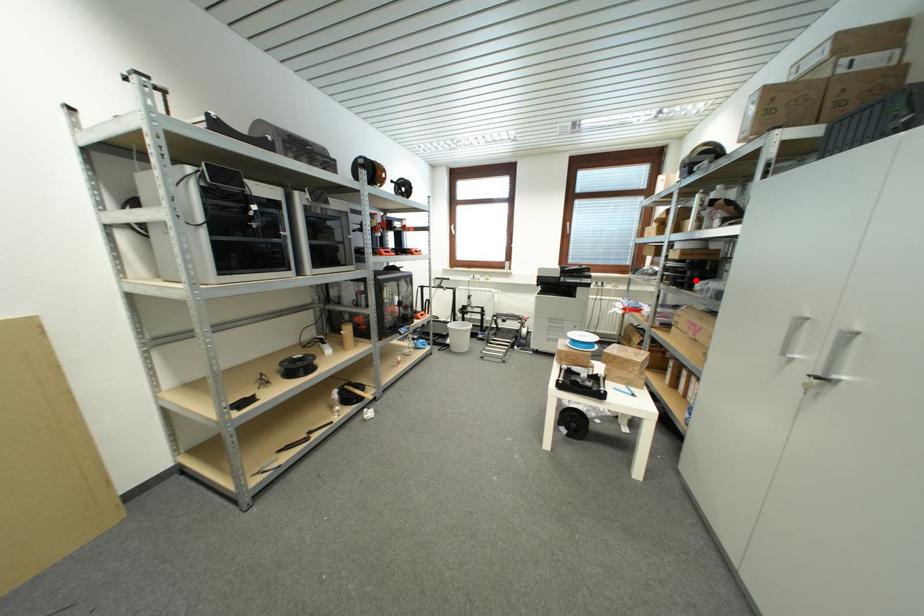
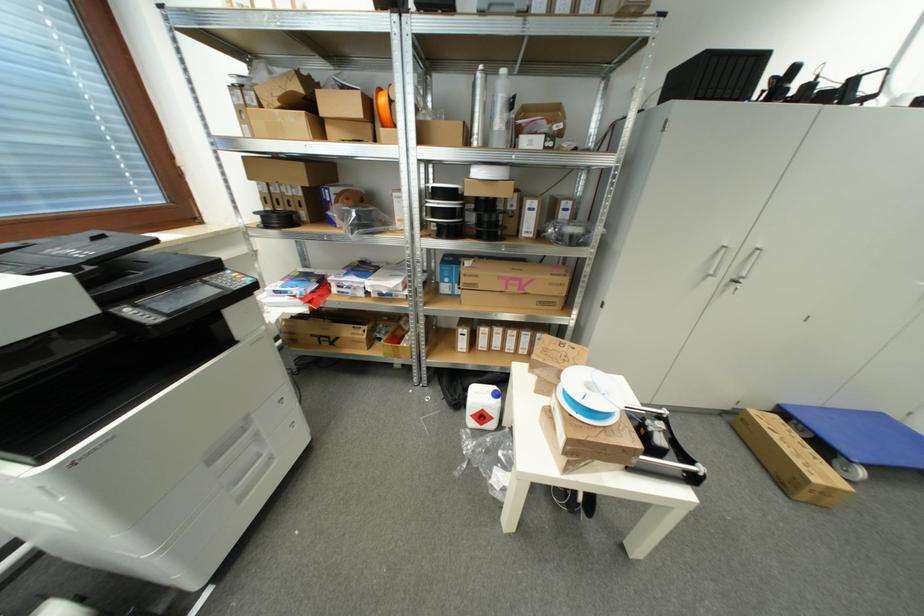
Question: I am providing you with two images of the same scene from different viewpoints. A red point is marked on the first image. At the location where the point appears in image 1, is it still visible in image 2?

Choices:
 (A) Yes
 (B) No

Answer: (A)